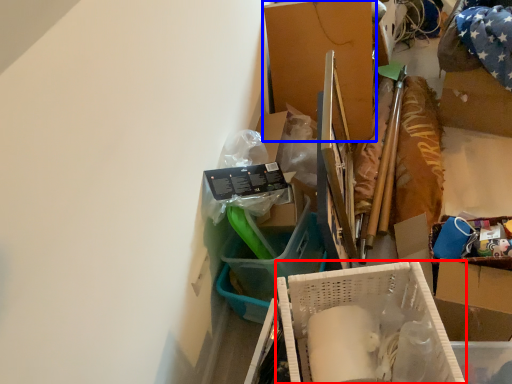
Question: Which object is further to the camera taking this photo, box (highlighted by a red box) or box (highlighted by a blue box)?

Choices:
 (A) box
 (B) box

Answer: (B)